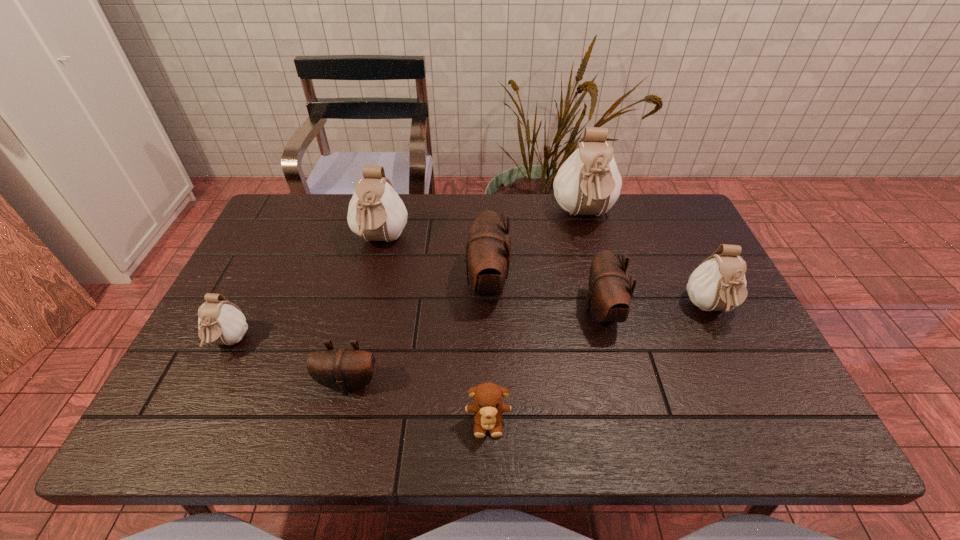
Where is `blank area in the image that satisfies the following two spatial constraints: 1. with the flap open on the second biggest brown pouch; 2. on the front-facing side of the smallest white pouch`? Image resolution: width=960 pixels, height=540 pixels. blank area in the image that satisfies the following two spatial constraints: 1. with the flap open on the second biggest brown pouch; 2. on the front-facing side of the smallest white pouch is located at coordinates (610, 342).

Where is `vacant space that satisfies the following two spatial constraints: 1. with the flap open on the second brown pouch from right to left; 2. on the front-facing side of the leftmost white pouch`? vacant space that satisfies the following two spatial constraints: 1. with the flap open on the second brown pouch from right to left; 2. on the front-facing side of the leftmost white pouch is located at coordinates (488, 342).

Identify the location of free spot that satisfies the following two spatial constraints: 1. on the front-facing side of the tallest pouch; 2. with the flap open on the fourth pouch from left to right. (602, 283).

The image size is (960, 540). Identify the location of free space that satisfies the following two spatial constraints: 1. with the flap open on the biggest brown pouch; 2. on the front-facing side of the leftmost object. (488, 342).

At what (x,y) coordinates should I click in order to perform the action: click on vacant space that satisfies the following two spatial constraints: 1. with the flap open on the rightmost brown pouch; 2. with the flap open on the second nearest object. Please return your answer as a coordinate pair (x, y). This screenshot has width=960, height=540. Looking at the image, I should click on pos(620,383).

Identify the location of vacant space that satisfies the following two spatial constraints: 1. with the flap open on the second biggest brown pouch; 2. on the front-facing side of the leftmost object. (610, 342).